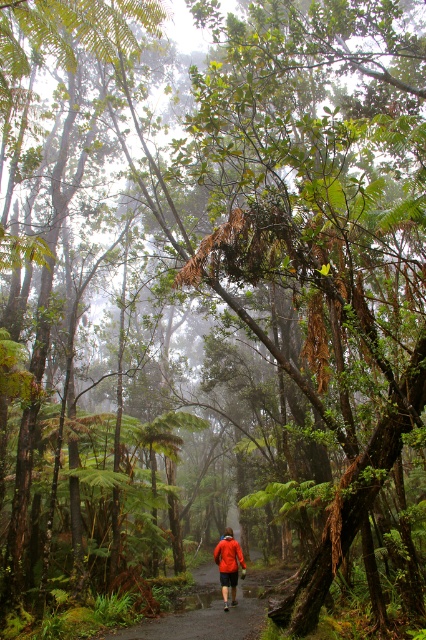
Question: Is dark brown dirt path at center to the right of red fabric jacket at center from the viewer's perspective?

Choices:
 (A) yes
 (B) no

Answer: (B)

Question: Which of the following is the closest to the observer?

Choices:
 (A) red fabric jacket at center
 (B) dark brown dirt path at center

Answer: (B)

Question: Can you confirm if dark brown dirt path at center is wider than red fabric jacket at center?

Choices:
 (A) no
 (B) yes

Answer: (B)

Question: Is dark brown dirt path at center positioned behind red fabric jacket at center?

Choices:
 (A) yes
 (B) no

Answer: (B)

Question: Which of the following is the closest to the observer?

Choices:
 (A) red fabric jacket at center
 (B) dark brown dirt path at center

Answer: (B)

Question: Which point is closer to the camera?

Choices:
 (A) (230, 620)
 (B) (227, 525)

Answer: (A)